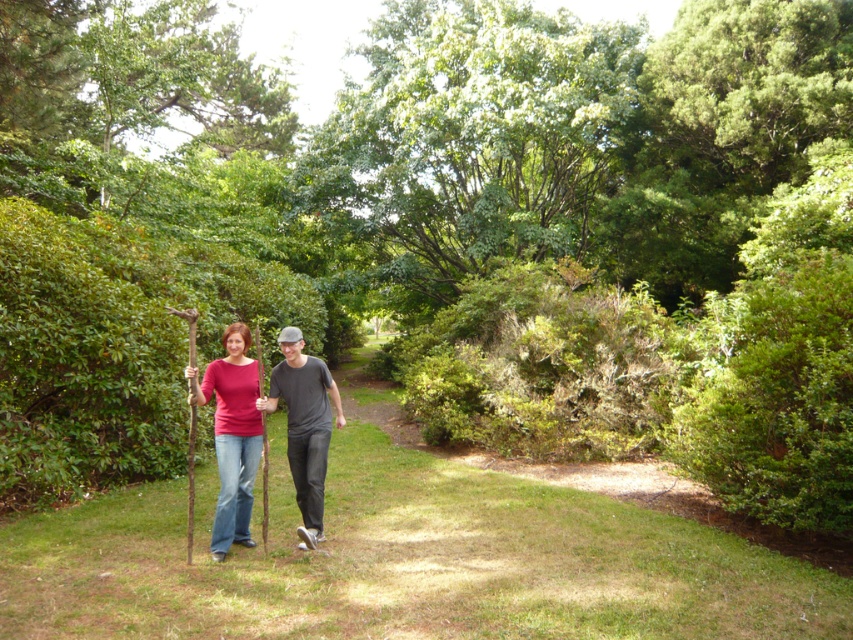
Based on the photo, please look at the image and identify the object located at the coordinates point (538, 365). Your answer should be one of the objects listed in the Objects section.

The object at point (538, 365) is the green leafy bush at center.

You are standing in the park and see the green leafy hedge at center and the green leafy bush at center. Which one is positioned to the left?

The green leafy hedge at center is positioned to the left of the green leafy bush at center.